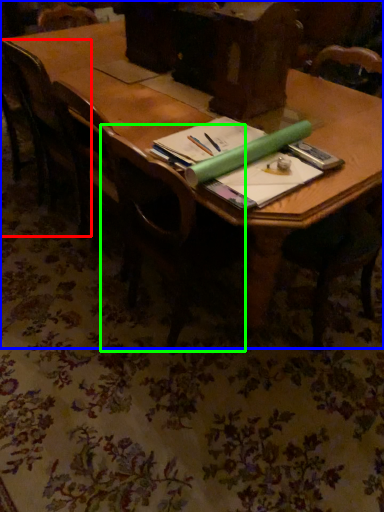
Question: Which is farther away from chair (highlighted by a red box)? table (highlighted by a blue box) or chair (highlighted by a green box)?

Choices:
 (A) table
 (B) chair

Answer: (B)